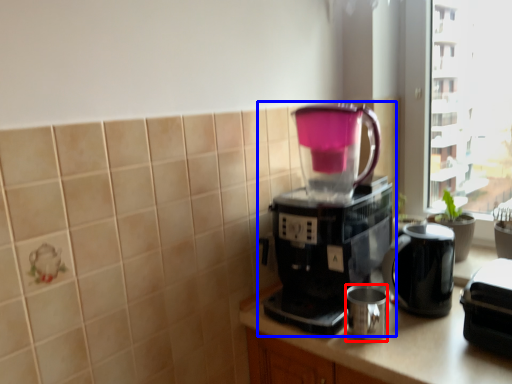
Question: Which object is further to the camera taking this photo, mug (highlighted by a red box) or coffee maker (highlighted by a blue box)?

Choices:
 (A) mug
 (B) coffee maker

Answer: (A)